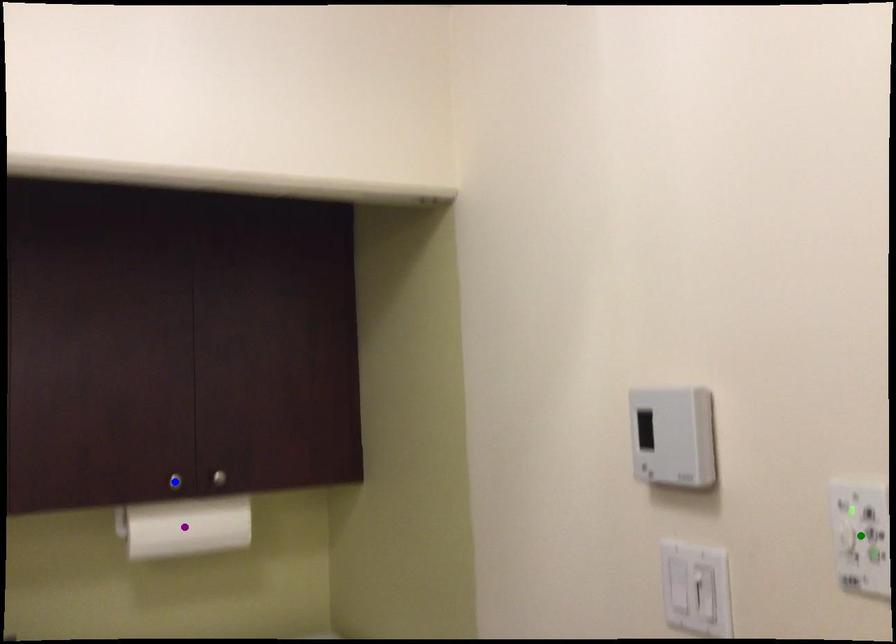
Order these from farthest to nearest:
purple point
green point
blue point

purple point, blue point, green point